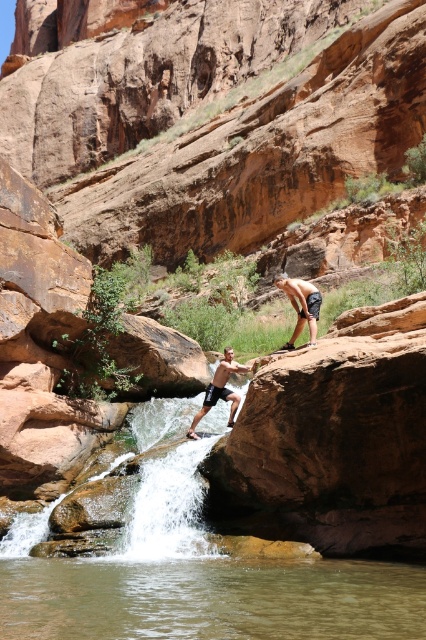
Question: Which of the following is the farthest from the observer?

Choices:
 (A) (201, 570)
 (B) (299, 308)
 (C) (219, 387)

Answer: (C)

Question: Is clear water at center to the left of dark blue shorts at center from the viewer's perspective?

Choices:
 (A) yes
 (B) no

Answer: (A)

Question: Which of the following is the closest to the observer?

Choices:
 (A) clear water at center
 (B) dark blue shorts at center

Answer: (A)

Question: Based on their relative distances, which object is farther from the dark blue shorts at center?

Choices:
 (A) matte black shorts at center
 (B) clear water at center

Answer: (B)

Question: Does clear water at center have a larger size compared to dark blue shorts at center?

Choices:
 (A) no
 (B) yes

Answer: (A)

Question: Is clear water at center thinner than matte black shorts at center?

Choices:
 (A) no
 (B) yes

Answer: (A)